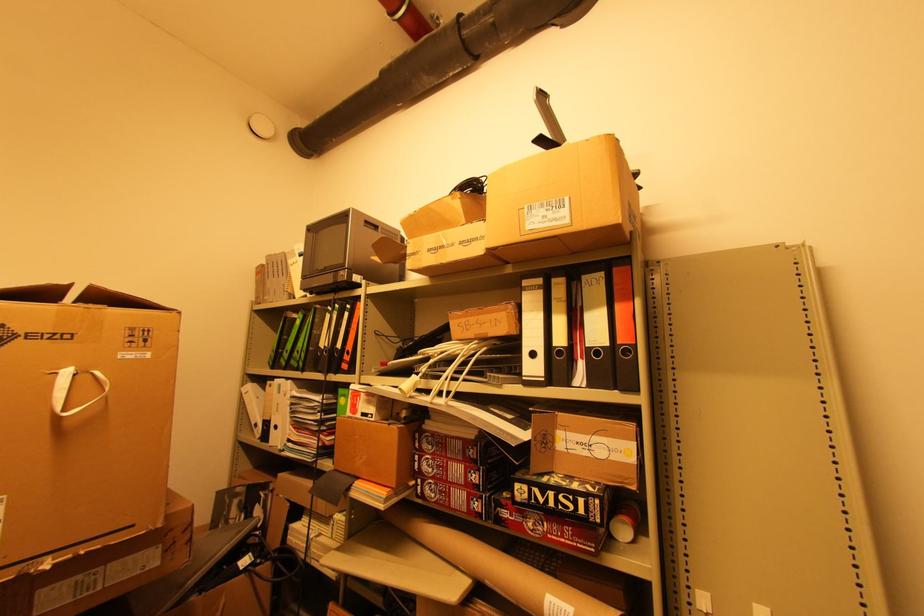
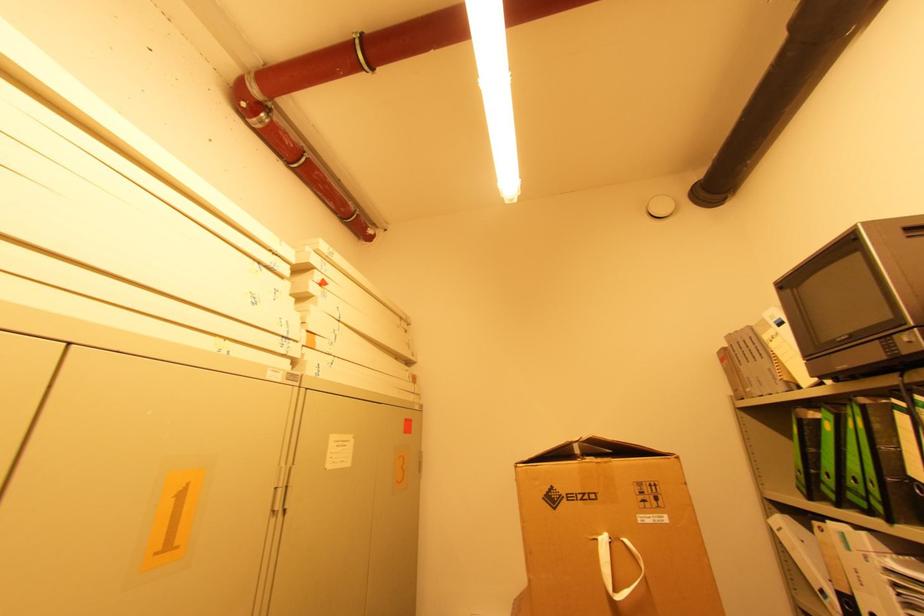
The point at (70,373) is marked in the first image. Where is the corresponding point in the second image?

(608, 541)